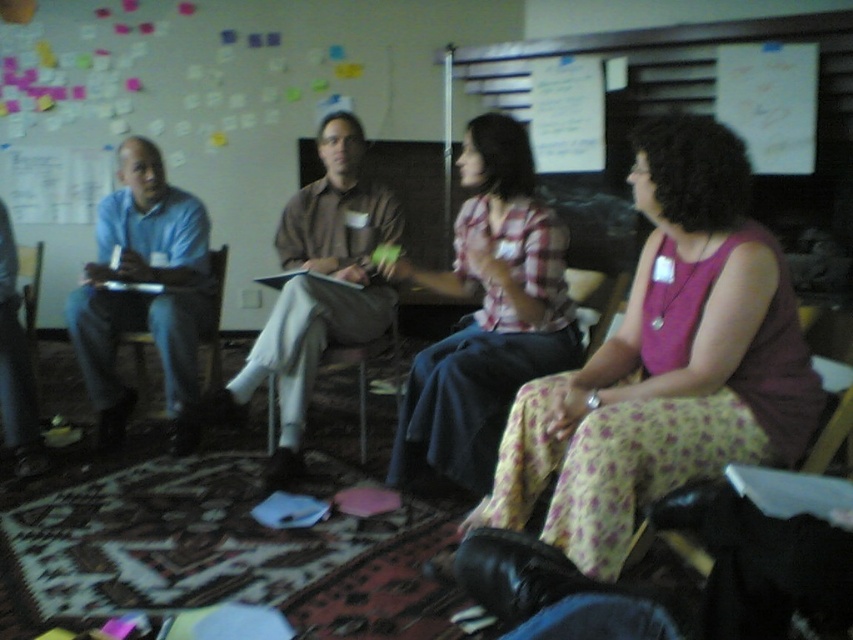
Can you confirm if floral print skirt at center is positioned to the left of plaid fabric shirt at center?

In fact, floral print skirt at center is to the right of plaid fabric shirt at center.

Between point (532, 490) and point (524, 310), which one is positioned in front?

Positioned in front is point (532, 490).

At what (x,y) coordinates should I click in order to perform the action: click on floral print skirt at center. Please return your answer as a coordinate pair (x, y). This screenshot has height=640, width=853. Looking at the image, I should click on (665, 362).

Does plaid fabric shirt at center have a larger size compared to matte blue shirt at left?

Correct, plaid fabric shirt at center is larger in size than matte blue shirt at left.

Can you confirm if plaid fabric shirt at center is shorter than matte blue shirt at left?

Yes.

Measure the distance between point (531, 170) and camera.

Point (531, 170) and camera are 2.54 meters apart from each other.

Where is `plaid fabric shirt at center`? This screenshot has height=640, width=853. plaid fabric shirt at center is located at coordinates (486, 314).

Does plaid fabric shirt at center lie in front of matte brown shirt at center?

Yes, plaid fabric shirt at center is closer to the viewer.

Between plaid fabric shirt at center and matte brown shirt at center, which one appears on the left side from the viewer's perspective?

matte brown shirt at center

Between point (500, 364) and point (386, 188), which one is positioned behind?

The point (386, 188) is behind.

Locate an element on the screen. This screenshot has width=853, height=640. plaid fabric shirt at center is located at coordinates (486, 314).